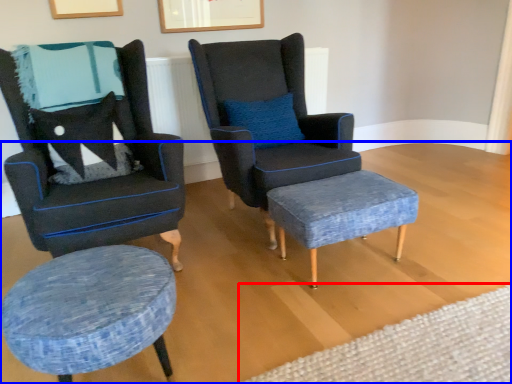
Question: Among these objects, which one is nearest to the camera, plain (highlighted by a red box) or plain (highlighted by a blue box)?

Choices:
 (A) plain
 (B) plain

Answer: (B)